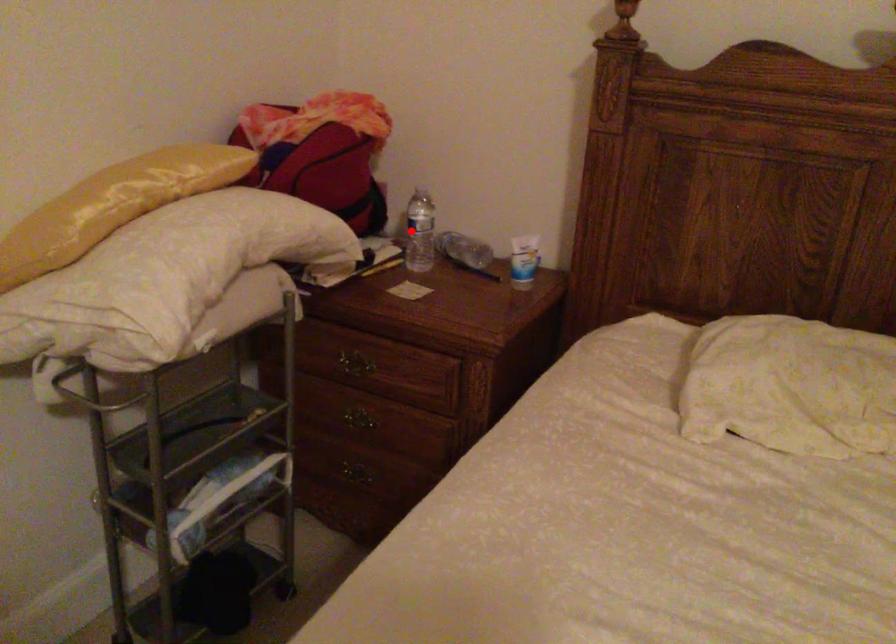
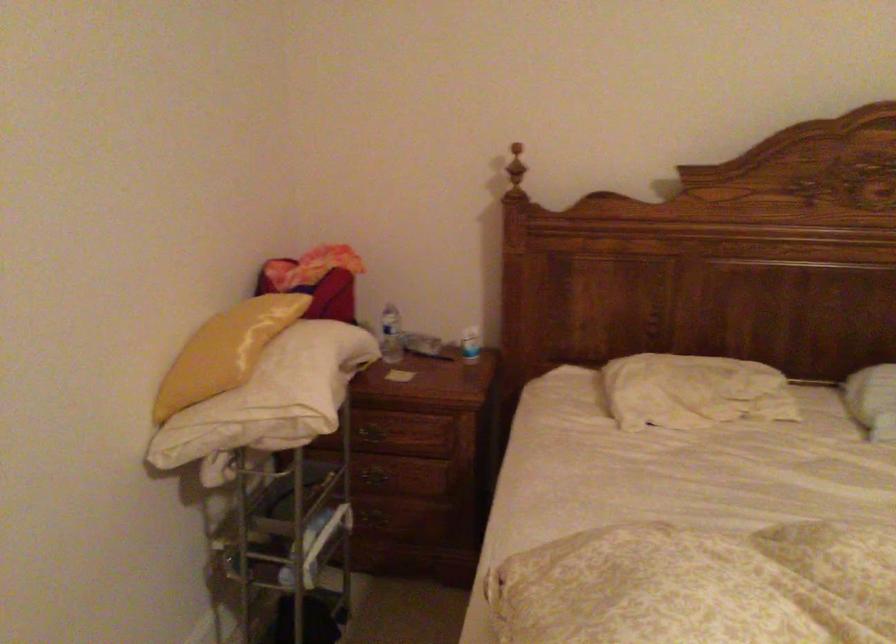
Question: A red point is marked in image1. In image2, is the corresponding 3D point closer to the camera or farther? Reply with the corresponding letter.

Choices:
 (A) The corresponding 3D point is closer.
 (B) The corresponding 3D point is farther.

Answer: (B)